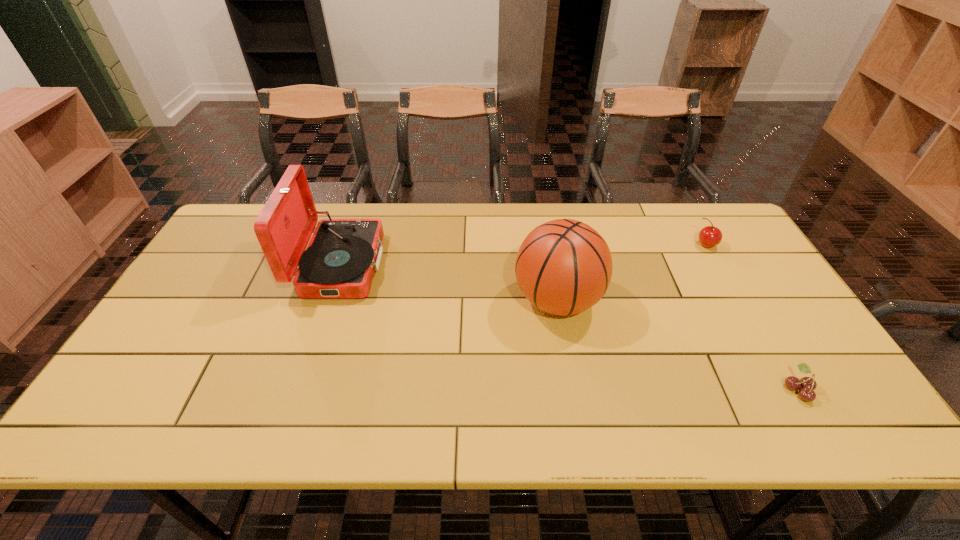
Find the location of a particular element. This screenshot has width=960, height=540. empty location between the basketball and the phonograph_record is located at coordinates (449, 283).

The width and height of the screenshot is (960, 540). I want to click on free space between the phonograph_record and the shorter cherry, so click(x=569, y=327).

At what (x,y) coordinates should I click in order to perform the action: click on object that stands as the second closest to the nearest object. Please return your answer as a coordinate pair (x, y). Looking at the image, I should click on (710, 236).

What are the coordinates of `the third closest object to the basketball` in the screenshot? It's located at (343, 254).

The height and width of the screenshot is (540, 960). I want to click on vacant region that satisfies the following two spatial constraints: 1. on the back side of the second object from left to right; 2. on the front-facing side of the leftmost object, so click(551, 265).

Identify the location of free space that satisfies the following two spatial constraints: 1. on the front-facing side of the leftmost object; 2. on the left side of the second object from left to right. (328, 301).

This screenshot has height=540, width=960. What are the coordinates of `vacant point that satisfies the following two spatial constraints: 1. on the back side of the second object from left to right; 2. on the right side of the third tallest object` in the screenshot? It's located at (547, 245).

Locate an element on the screen. vacant area that satisfies the following two spatial constraints: 1. on the front side of the farther cherry; 2. on the front-facing side of the leftmost object is located at coordinates (718, 265).

Identify the location of vacant region that satisfies the following two spatial constraints: 1. on the back side of the second object from left to right; 2. on the right side of the third tallest object. The image size is (960, 540). (547, 245).